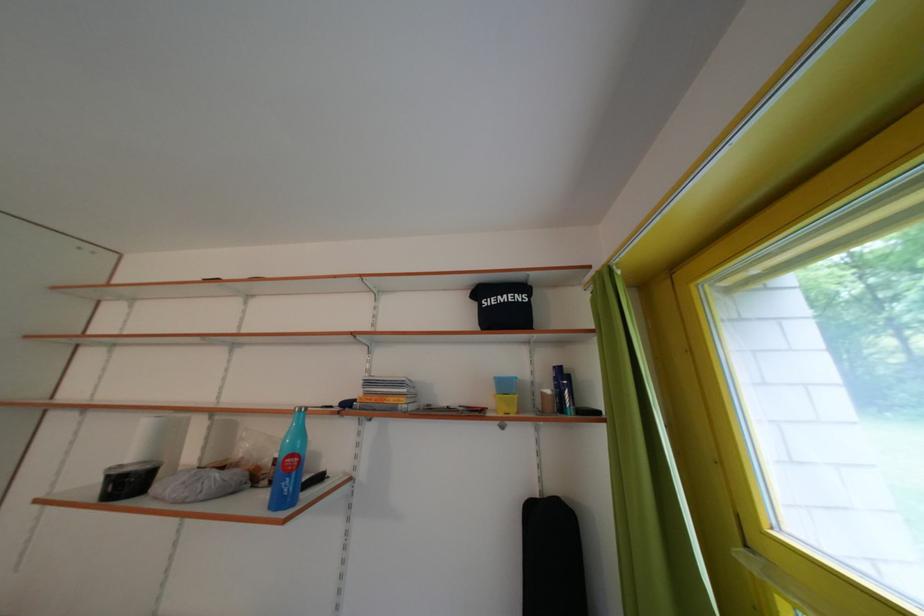
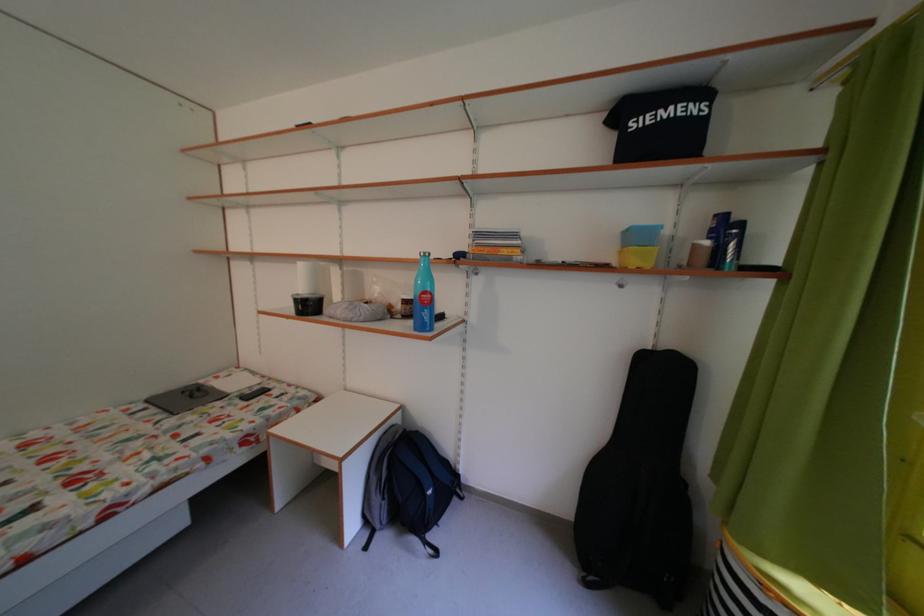
The point at [282,488] is marked in the first image. Where is the corresponding point in the second image?

(416, 322)